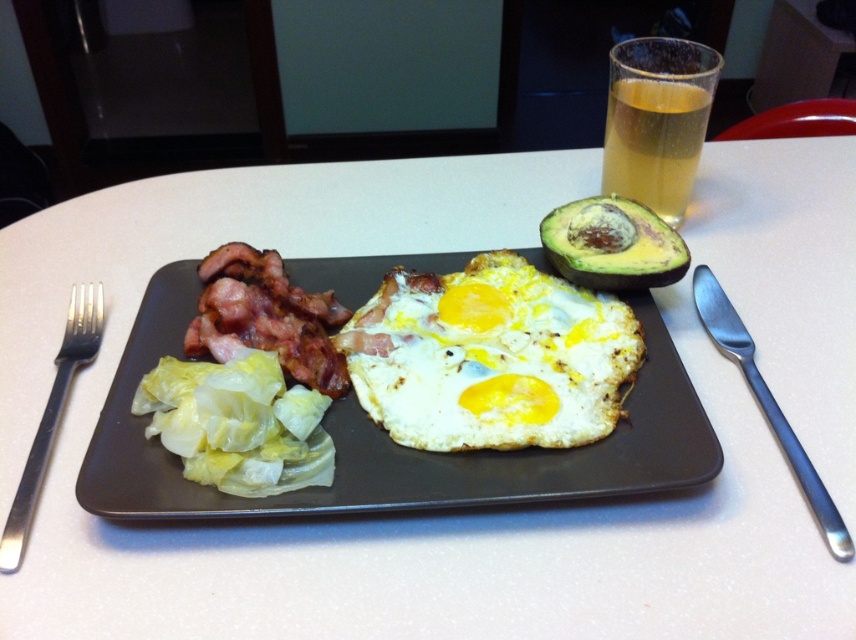
Question: Which is nearer to the satin silver knife at right?

Choices:
 (A) translucent glass at upper right
 (B) green matte avocado at upper right
 (C) fried yellow egg at center
 (D) black metal fork at left

Answer: (B)

Question: Which point is farther from the camera taking this photo?

Choices:
 (A) (447, 456)
 (B) (424, 438)
 (C) (752, 342)

Answer: (C)

Question: Considering the real-world distances, which object is farthest from the satin silver knife at right?

Choices:
 (A) fried yellow egg at center
 (B) translucent glass at upper right

Answer: (A)

Question: Can you confirm if slightly crispy bacon at center-left is wider than green matte avocado at upper right?

Choices:
 (A) yes
 (B) no

Answer: (A)

Question: Can you confirm if translucent glass at upper right is positioned below satin silver knife at right?

Choices:
 (A) yes
 (B) no

Answer: (B)

Question: Is matte ceramic plate at center smaller than translucent glass at upper right?

Choices:
 (A) no
 (B) yes

Answer: (A)